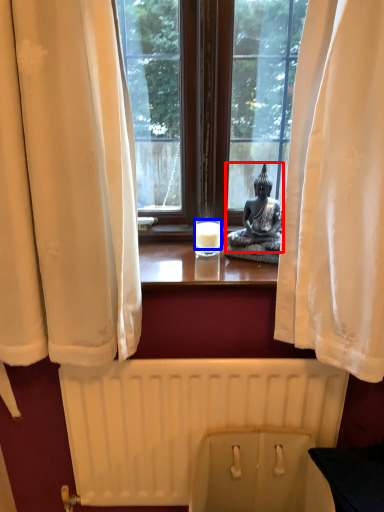
Question: Which of the following is the closest to the observer, person (highlighted by a red box) or candle (highlighted by a blue box)?

Choices:
 (A) person
 (B) candle

Answer: (A)